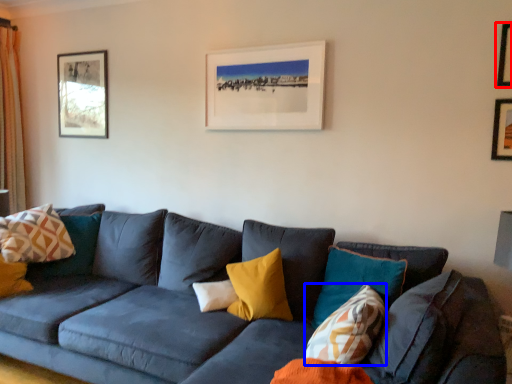
Question: Among these objects, which one is farthest to the camera, picture frame (highlighted by a red box) or pillow (highlighted by a blue box)?

Choices:
 (A) picture frame
 (B) pillow

Answer: (A)